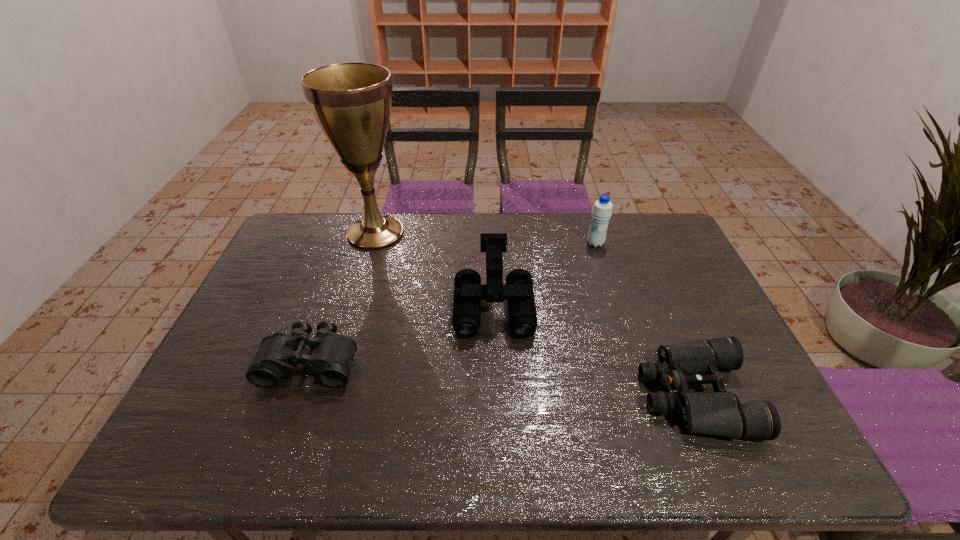
At what (x,y) coordinates should I click in order to perform the action: click on vacant space situated through the eyepieces of the rightmost binoculars. Please return your answer as a coordinate pair (x, y). The width and height of the screenshot is (960, 540). Looking at the image, I should click on (498, 395).

The image size is (960, 540). What are the coordinates of `vacant space located 0.260m through the eyepieces of the rightmost binoculars` in the screenshot? It's located at (536, 395).

Where is `free space located through the eyepieces of the rightmost binoculars`? The image size is (960, 540). free space located through the eyepieces of the rightmost binoculars is located at coordinates (585, 395).

Locate an element on the screen. This screenshot has height=540, width=960. trophy cup at the far edge is located at coordinates (351, 102).

Where is `water bottle located in the far edge section of the desktop`? The image size is (960, 540). water bottle located in the far edge section of the desktop is located at coordinates (602, 210).

Locate an element on the screen. object that is positioned at the near edge is located at coordinates (720, 413).

Find the location of a particular element. The width and height of the screenshot is (960, 540). object located at the left edge is located at coordinates (331, 356).

The width and height of the screenshot is (960, 540). I want to click on object at the right edge, so click(x=720, y=413).

Image resolution: width=960 pixels, height=540 pixels. Identify the location of object present at the near right corner. (720, 413).

Find the location of a particular element. vacant region at the far edge of the desktop is located at coordinates (425, 221).